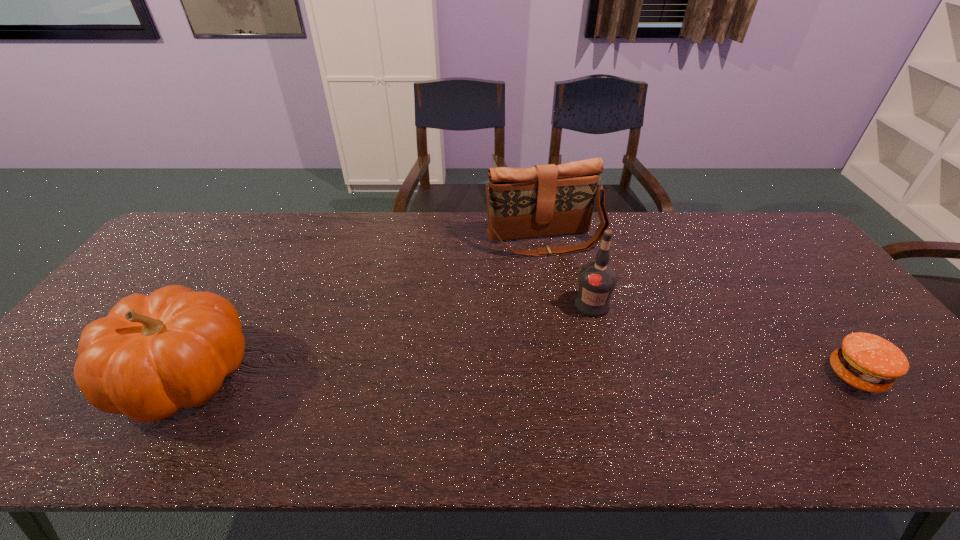
Where is `empty space that is in between the shoulder bag and the third nearest object`? Image resolution: width=960 pixels, height=540 pixels. empty space that is in between the shoulder bag and the third nearest object is located at coordinates (568, 272).

Locate an element on the screen. This screenshot has height=540, width=960. vacant area that lies between the second farthest object and the shoulder bag is located at coordinates (568, 272).

Locate an element on the screen. The height and width of the screenshot is (540, 960). the third closest object to the leftmost object is located at coordinates coord(868,362).

Select which object is the second closest to the third nearest object. Please provide its 2D coordinates. Your answer should be formatted as a tuple, i.e. [(x, y)], where the tuple contains the x and y coordinates of a point satisfying the conditions above.

[(868, 362)]

This screenshot has height=540, width=960. In order to click on vacant space that satisfies the following two spatial constraints: 1. on the back side of the leftmost object; 2. on the right side of the farthest object in this screenshot , I will do `click(265, 240)`.

Image resolution: width=960 pixels, height=540 pixels. Identify the location of free space that satisfies the following two spatial constraints: 1. on the back side of the shoulder bag; 2. on the right side of the pumpkin. (265, 240).

In order to click on blank area in the image that satisfies the following two spatial constraints: 1. on the front side of the third nearest object; 2. on the left side of the shoulder bag in this screenshot , I will do `click(556, 305)`.